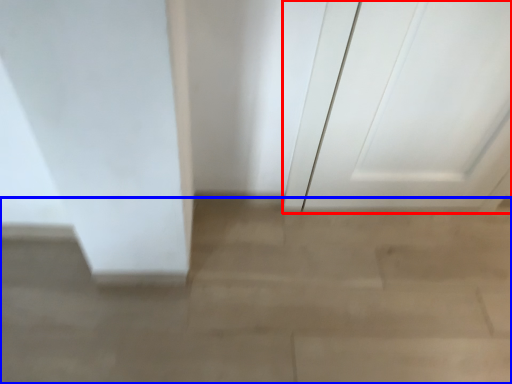
Question: Which object is closer to the camera taking this photo, door (highlighted by a red box) or concrete (highlighted by a blue box)?

Choices:
 (A) door
 (B) concrete

Answer: (A)